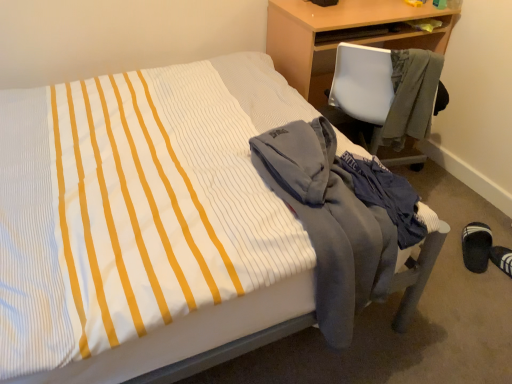
You are a GUI agent. You are given a task and a screenshot of the screen. Output one action in this format:
    pyautogui.click(x=<x>, y=<y>)
    Task: Click on the black fabric slipper at lower right
    The width and height of the screenshot is (512, 384).
    Given the screenshot: What is the action you would take?
    pyautogui.click(x=476, y=246)

The image size is (512, 384). Describe the element at coordinates (342, 36) in the screenshot. I see `wooden desk at upper right` at that location.

Identify the location of gray fleece jacket at lower right, which appears as the 2th jacket when viewed from the right. This screenshot has height=384, width=512. (329, 222).

Locate an element on the screen. This screenshot has height=384, width=512. jacket in front of the gray fleece jacket at right, which is the second jacket from left to right is located at coordinates (329, 222).

Between gray fleece jacket at right, the 1th jacket viewed from the right, and gray fleece jacket at lower right, which ranks as the first jacket in left-to-right order, which one is positioned behind?

Positioned behind is gray fleece jacket at right, the 1th jacket viewed from the right.

Who is smaller, gray fleece jacket at right, placed as the 1th jacket when sorted from top to bottom, or gray fleece jacket at lower right, the second jacket from the top?

gray fleece jacket at right, placed as the 1th jacket when sorted from top to bottom, is smaller.

How distant is gray fleece jacket at right, placed as the 1th jacket when sorted from top to bottom, from gray fleece jacket at lower right, which appears as the 2th jacket when viewed from the right?

They are 64.37 centimeters apart.

From the image's perspective, between wooden desk at upper right and gray fleece jacket at lower right, the second jacket from the top, which one is located above?

wooden desk at upper right appears higher in the image.

Which object is positioned more to the left, wooden desk at upper right or gray fleece jacket at lower right, the 1th jacket when ordered from bottom to top?

gray fleece jacket at lower right, the 1th jacket when ordered from bottom to top.

Looking at this image, is wooden desk at upper right outside of gray fleece jacket at lower right, which ranks as the first jacket in left-to-right order?

Absolutely, wooden desk at upper right is external to gray fleece jacket at lower right, which ranks as the first jacket in left-to-right order.

Is wooden desk at upper right wider than gray fleece jacket at lower right, the 1th jacket when ordered from bottom to top?

No, wooden desk at upper right is not wider than gray fleece jacket at lower right, the 1th jacket when ordered from bottom to top.

Consider the image. Considering the relative sizes of gray fleece jacket at right, which is the second jacket from left to right, and black fabric slipper at lower right in the image provided, is gray fleece jacket at right, which is the second jacket from left to right, bigger than black fabric slipper at lower right?

Yes, gray fleece jacket at right, which is the second jacket from left to right, is bigger than black fabric slipper at lower right.

Can we say gray fleece jacket at right, which is the second jacket from left to right, lies outside black fabric slipper at lower right?

gray fleece jacket at right, which is the second jacket from left to right, is positioned outside black fabric slipper at lower right.

Between gray fleece jacket at right, placed as the 1th jacket when sorted from top to bottom, and black fabric slipper at lower right, which one has more height?

Standing taller between the two is gray fleece jacket at right, placed as the 1th jacket when sorted from top to bottom.

Is gray fleece jacket at right, the second jacket when ordered from bottom to top, touching black fabric slipper at lower right?

gray fleece jacket at right, the second jacket when ordered from bottom to top, and black fabric slipper at lower right are not in contact.

Identify the location of footwear behind the gray fleece jacket at lower right, the 1th jacket when ordered from bottom to top. The image size is (512, 384). (476, 246).

Which is more to the left, gray fleece jacket at lower right, which ranks as the first jacket in left-to-right order, or black fabric slipper at lower right?

gray fleece jacket at lower right, which ranks as the first jacket in left-to-right order.

Does point (286, 188) lie in front of point (473, 259)?

Yes, point (286, 188) is in front of point (473, 259).

From the image's perspective, does black fabric slipper at lower right appear higher than wooden desk at upper right?

No, from the image's perspective, black fabric slipper at lower right is not over wooden desk at upper right.

Can you confirm if black fabric slipper at lower right is positioned to the right of wooden desk at upper right?

Correct, you'll find black fabric slipper at lower right to the right of wooden desk at upper right.

From a real-world perspective, between black fabric slipper at lower right and wooden desk at upper right, who is vertically higher?

From a 3D spatial view, wooden desk at upper right is above.

Considering the relative sizes of black fabric slipper at lower right and wooden desk at upper right in the image provided, is black fabric slipper at lower right taller than wooden desk at upper right?

No, black fabric slipper at lower right is not taller than wooden desk at upper right.

Considering the positions of objects gray fleece jacket at lower right, the 1th jacket when ordered from bottom to top, and gray fleece jacket at right, which is the second jacket from left to right, in the image provided, who is more to the left, gray fleece jacket at lower right, the 1th jacket when ordered from bottom to top, or gray fleece jacket at right, which is the second jacket from left to right,?

gray fleece jacket at lower right, the 1th jacket when ordered from bottom to top.

What's the angular difference between gray fleece jacket at lower right, the second jacket from the top, and gray fleece jacket at right, which is the second jacket from left to right,'s facing directions?

The angular difference between gray fleece jacket at lower right, the second jacket from the top, and gray fleece jacket at right, which is the second jacket from left to right, is 139 degrees.

Is gray fleece jacket at lower right, the 1th jacket when ordered from bottom to top, far from gray fleece jacket at right, placed as the 1th jacket when sorted from top to bottom?

They are positioned close to each other.

Between black fabric slipper at lower right and gray fleece jacket at right, which is the second jacket from left to right, which one has larger size?

Bigger between the two is gray fleece jacket at right, which is the second jacket from left to right.

Which object is positioned more to the right, black fabric slipper at lower right or gray fleece jacket at right, the second jacket when ordered from bottom to top?

black fabric slipper at lower right is more to the right.

From the image's perspective, is black fabric slipper at lower right located above or below gray fleece jacket at right, placed as the 1th jacket when sorted from top to bottom?

black fabric slipper at lower right is situated lower than gray fleece jacket at right, placed as the 1th jacket when sorted from top to bottom, in the image.

Is black fabric slipper at lower right far from gray fleece jacket at right, which is the second jacket from left to right?

They are positioned close to each other.

In the image, there is a gray fleece jacket at right, which is the second jacket from left to right. Identify the location of jacket below it (from the image's perspective). (329, 222).

Image resolution: width=512 pixels, height=384 pixels. Find the location of `the 1st jacket directly above the wooden desk at upper right (from a real-world perspective)`. the 1st jacket directly above the wooden desk at upper right (from a real-world perspective) is located at coordinates (329, 222).

Based on the photo, estimate the real-world distances between objects in this image. Which object is closer to gray fleece jacket at right, the second jacket when ordered from bottom to top, black fabric slipper at lower right or gray fleece jacket at lower right, the 1th jacket when ordered from bottom to top?

Based on the image, black fabric slipper at lower right appears to be nearer to gray fleece jacket at right, the second jacket when ordered from bottom to top.

When comparing their distances from gray fleece jacket at lower right, which appears as the 2th jacket when viewed from the right, does wooden desk at upper right or black fabric slipper at lower right seem closer?

wooden desk at upper right is positioned closer to the anchor gray fleece jacket at lower right, which appears as the 2th jacket when viewed from the right.

Considering their positions, is gray fleece jacket at lower right, the second jacket from the top, positioned closer to gray fleece jacket at right, the second jacket when ordered from bottom to top, than black fabric slipper at lower right?

Based on the image, black fabric slipper at lower right appears to be nearer to gray fleece jacket at right, the second jacket when ordered from bottom to top.

Looking at the image, which one is located closer to gray fleece jacket at lower right, which ranks as the first jacket in left-to-right order, gray fleece jacket at right, the second jacket when ordered from bottom to top, or black fabric slipper at lower right?

gray fleece jacket at right, the second jacket when ordered from bottom to top, is closer to gray fleece jacket at lower right, which ranks as the first jacket in left-to-right order.

Consider the image. Based on their spatial positions, is gray fleece jacket at right, which is the second jacket from left to right, or gray fleece jacket at lower right, which appears as the 2th jacket when viewed from the right, further from black fabric slipper at lower right?

gray fleece jacket at lower right, which appears as the 2th jacket when viewed from the right, is further to black fabric slipper at lower right.

Based on their spatial positions, is black fabric slipper at lower right or wooden desk at upper right further from gray fleece jacket at right, the second jacket when ordered from bottom to top?

black fabric slipper at lower right lies further to gray fleece jacket at right, the second jacket when ordered from bottom to top, than the other object.

Estimate the real-world distances between objects in this image. Which object is closer to black fabric slipper at lower right, gray fleece jacket at right, the 1th jacket viewed from the right, or wooden desk at upper right?

gray fleece jacket at right, the 1th jacket viewed from the right, is closer to black fabric slipper at lower right.

Consider the image. Estimate the real-world distances between objects in this image. Which object is further from gray fleece jacket at right, the 1th jacket viewed from the right, gray fleece jacket at lower right, which appears as the 2th jacket when viewed from the right, or wooden desk at upper right?

gray fleece jacket at lower right, which appears as the 2th jacket when viewed from the right, is further to gray fleece jacket at right, the 1th jacket viewed from the right.

Locate an element on the screen. This screenshot has width=512, height=384. jacket positioned between gray fleece jacket at lower right, which appears as the 2th jacket when viewed from the right, and wooden desk at upper right from near to far is located at coordinates (411, 95).

The height and width of the screenshot is (384, 512). In order to click on jacket positioned between gray fleece jacket at lower right, the second jacket from the top, and black fabric slipper at lower right from near to far in this screenshot , I will do `click(411, 95)`.

Locate an element on the screen. The height and width of the screenshot is (384, 512). footwear positioned between gray fleece jacket at lower right, the 1th jacket when ordered from bottom to top, and wooden desk at upper right from near to far is located at coordinates (476, 246).